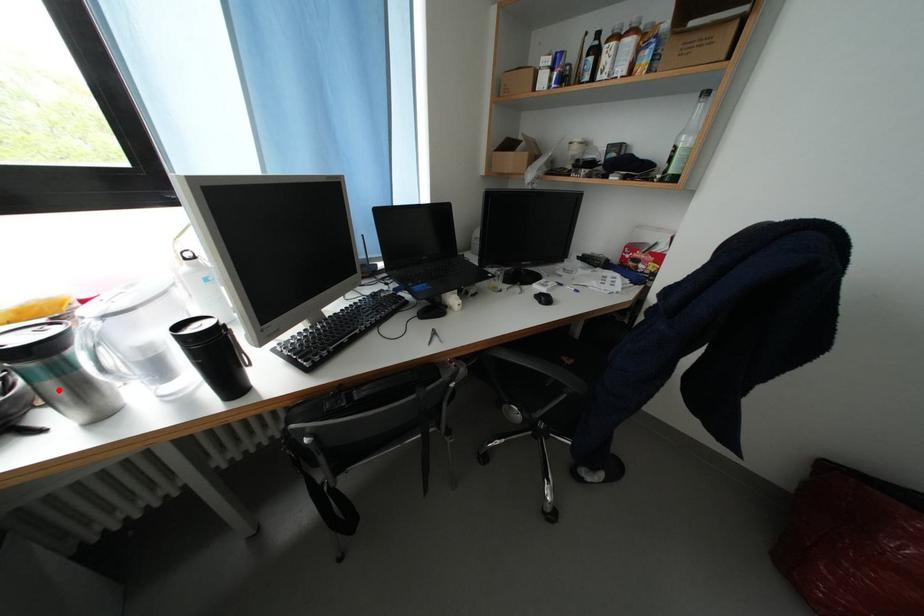
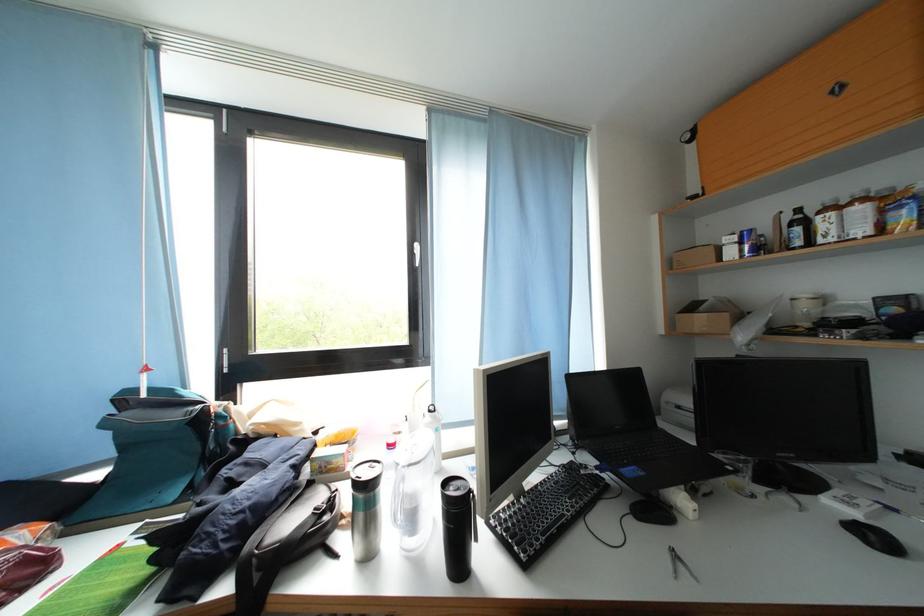
Question: I am providing you with two images of the same scene from different viewpoints. Image1 has a red point marked. In image2, the corresponding 3D location appears at what relative position? Reply with the corresponding letter.

Choices:
 (A) Closer
 (B) Farther

Answer: (B)